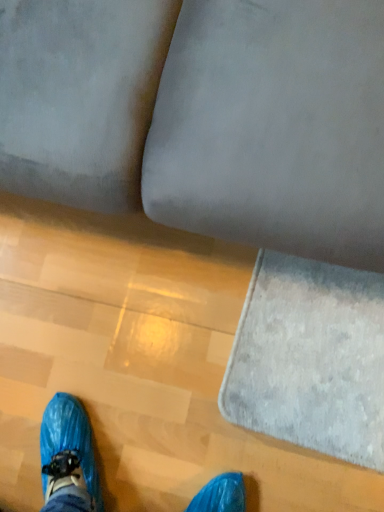
I want to click on velvet gray couch at center, so click(x=204, y=116).

Describe the element at coordinates (204, 116) in the screenshot. I see `velvet gray couch at center` at that location.

You are a GUI agent. You are given a task and a screenshot of the screen. Output one action in this format:
    pyautogui.click(x=<x>, y=<y>)
    Task: Click on the white fluffy mat at lower right
    The width and height of the screenshot is (384, 512).
    Given the screenshot: What is the action you would take?
    pyautogui.click(x=310, y=358)

What do you see at coordinates (310, 358) in the screenshot? I see `white fluffy mat at lower right` at bounding box center [310, 358].

Find the location of `velvet gray couch at center`. velvet gray couch at center is located at coordinates (204, 116).

Consider the image. Visually, is velvet gray couch at center positioned to the left or to the right of white fluffy mat at lower right?

velvet gray couch at center is to the left of white fluffy mat at lower right.

Which object is closer to the camera, velvet gray couch at center or white fluffy mat at lower right?

velvet gray couch at center.

Does point (280, 161) come in front of point (261, 402)?

Yes, point (280, 161) is closer to viewer.

From the image's perspective, does velvet gray couch at center appear higher than white fluffy mat at lower right?

Indeed, from the image's perspective, velvet gray couch at center is shown above white fluffy mat at lower right.

From a real-world perspective, is velvet gray couch at center physically located above or below white fluffy mat at lower right?

velvet gray couch at center is situated higher than white fluffy mat at lower right in the real world.

Between velvet gray couch at center and white fluffy mat at lower right, which one has smaller width?

With smaller width is white fluffy mat at lower right.

Does velvet gray couch at center have a greater height compared to white fluffy mat at lower right?

Correct, velvet gray couch at center is much taller as white fluffy mat at lower right.

Which of these two, velvet gray couch at center or white fluffy mat at lower right, is bigger?

Bigger between the two is velvet gray couch at center.

Would you say white fluffy mat at lower right is part of velvet gray couch at center's contents?

Actually, white fluffy mat at lower right is outside velvet gray couch at center.

Are velvet gray couch at center and white fluffy mat at lower right located far from each other?

No.

Could you tell me if velvet gray couch at center is turned towards white fluffy mat at lower right?

Yes, velvet gray couch at center is turned towards white fluffy mat at lower right.

Can you tell me how much velvet gray couch at center and white fluffy mat at lower right differ in facing direction?

There is a 3.07-degree angle between the facing directions of velvet gray couch at center and white fluffy mat at lower right.

Identify the location of studio couch that is above the white fluffy mat at lower right (from a real-world perspective). Image resolution: width=384 pixels, height=512 pixels. (204, 116).

Based on their positions, is white fluffy mat at lower right located to the left or right of velvet gray couch at center?

In the image, white fluffy mat at lower right appears on the right side of velvet gray couch at center.

Is white fluffy mat at lower right in front of or behind velvet gray couch at center in the image?

Clearly, white fluffy mat at lower right is behind velvet gray couch at center.

Is point (343, 321) closer to camera compared to point (256, 155)?

No, it is not.

Looking at this image, from the image's perspective, does white fluffy mat at lower right appear higher than velvet gray couch at center?

No.

From a real-world perspective, is white fluffy mat at lower right physically above velvet gray couch at center?

Actually, white fluffy mat at lower right is physically below velvet gray couch at center in the real world.

Which object is wider, white fluffy mat at lower right or velvet gray couch at center?

Wider between the two is velvet gray couch at center.

In the scene shown: Considering the sizes of objects white fluffy mat at lower right and velvet gray couch at center in the image provided, who is shorter, white fluffy mat at lower right or velvet gray couch at center?

white fluffy mat at lower right is shorter.

In terms of size, does white fluffy mat at lower right appear bigger or smaller than velvet gray couch at center?

Clearly, white fluffy mat at lower right is smaller in size than velvet gray couch at center.

Is velvet gray couch at center located within white fluffy mat at lower right?

Definitely not — velvet gray couch at center is not inside white fluffy mat at lower right.

Are white fluffy mat at lower right and velvet gray couch at center located far from each other?

No, there isn't a large distance between white fluffy mat at lower right and velvet gray couch at center.

Is white fluffy mat at lower right aimed at velvet gray couch at center?

No, white fluffy mat at lower right is not oriented towards velvet gray couch at center.

Where is `studio couch lying on the left of white fluffy mat at lower right`? studio couch lying on the left of white fluffy mat at lower right is located at coordinates (204, 116).

At what (x,y) coordinates should I click in order to perform the action: click on studio couch on the left of white fluffy mat at lower right. Please return your answer as a coordinate pair (x, y). The width and height of the screenshot is (384, 512). Looking at the image, I should click on (204, 116).

Identify the location of studio couch that appears above the white fluffy mat at lower right (from the image's perspective). The height and width of the screenshot is (512, 384). (204, 116).